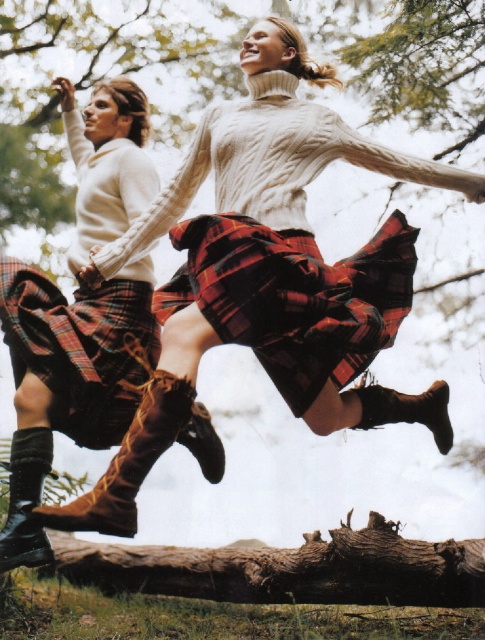
Who is higher up, black leather boot at lower left or brown suede boot at lower center?

brown suede boot at lower center is higher up.

Identify the location of black leather boot at lower left. (26, 499).

Is plaid fabric skirt at center below brown suede boot at lower left?

No.

Is point (189, 264) farther from camera compared to point (119, 497)?

Yes, point (189, 264) is farther from viewer.

Is point (216, 275) positioned after point (167, 438)?

That is True.

The width and height of the screenshot is (485, 640). In order to click on plaid fabric skirt at center in this screenshot , I will do `click(293, 296)`.

Does plaid wool kilt at lower left appear under brown suede boot at lower center?

No.

Who is more forward, (108,397) or (391,419)?

Positioned in front is point (108,397).

Identify the location of plaid wool kilt at lower left. Image resolution: width=485 pixels, height=640 pixels. (80, 348).

I want to click on plaid wool kilt at lower left, so click(x=80, y=348).